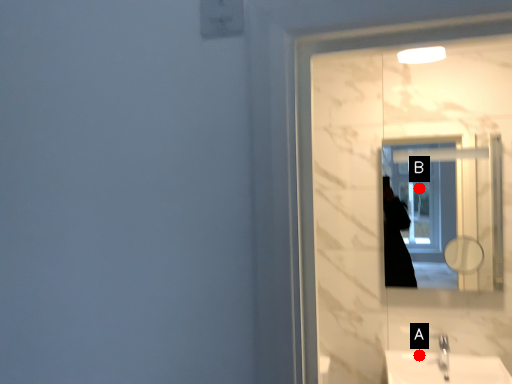
Question: Two points are circled on the image, labeled by A and B beside each circle. Which point is closer to the camera?

Choices:
 (A) A is closer
 (B) B is closer

Answer: (A)